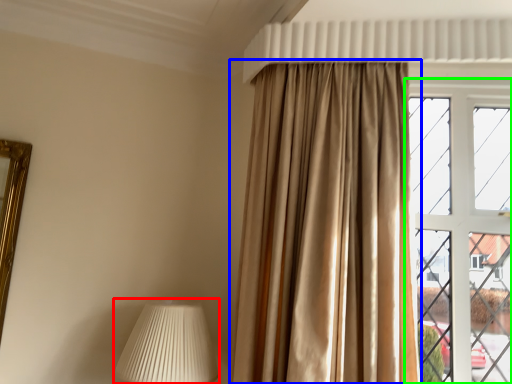
Question: Which object is the farthest from table lamp (highlighted by a red box)? Choose among these: curtain (highlighted by a blue box) or window (highlighted by a green box).

Choices:
 (A) curtain
 (B) window

Answer: (B)